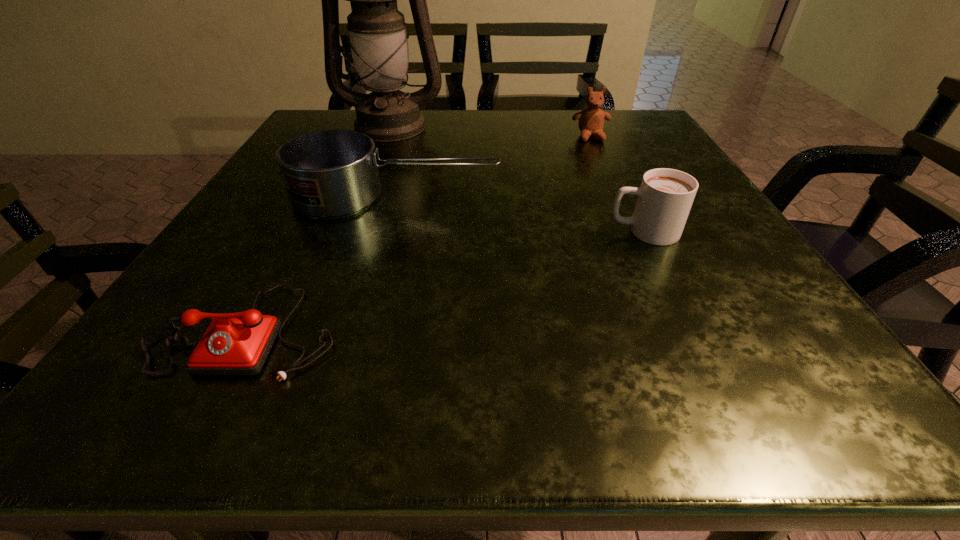
Locate an element on the screen. free point between the telephone and the cappuccino is located at coordinates (445, 281).

You are a GUI agent. You are given a task and a screenshot of the screen. Output one action in this format:
    pyautogui.click(x=<x>, y=<y>)
    Task: Click on the vacant area between the teddy bear and the cappuccino
    This screenshot has width=960, height=540.
    Given the screenshot: What is the action you would take?
    pyautogui.click(x=617, y=184)

This screenshot has width=960, height=540. I want to click on vacant region between the nearest object and the oil lamp, so (319, 228).

You are a GUI agent. You are given a task and a screenshot of the screen. Output one action in this format:
    pyautogui.click(x=<x>, y=<y>)
    Task: Click on the free area in between the cappuccino and the tallest object
    The width and height of the screenshot is (960, 540).
    Given the screenshot: What is the action you would take?
    pyautogui.click(x=517, y=179)

Where is `free space between the oil lamp and the nearest object`? The image size is (960, 540). free space between the oil lamp and the nearest object is located at coordinates [319, 228].

The width and height of the screenshot is (960, 540). What are the coordinates of `free space that is in between the saucepan and the teddy bear` in the screenshot? It's located at (493, 167).

Find the location of `vacant area that lies between the teddy bear and the cappuccino`. vacant area that lies between the teddy bear and the cappuccino is located at coordinates (617, 184).

Locate an element on the screen. The height and width of the screenshot is (540, 960). object that is the closest to the tallest object is located at coordinates (333, 173).

Choose which object is the third nearest neighbor to the teddy bear. Please provide its 2D coordinates. Your answer should be formatted as a tuple, i.e. [(x, y)], where the tuple contains the x and y coordinates of a point satisfying the conditions above.

[(665, 196)]